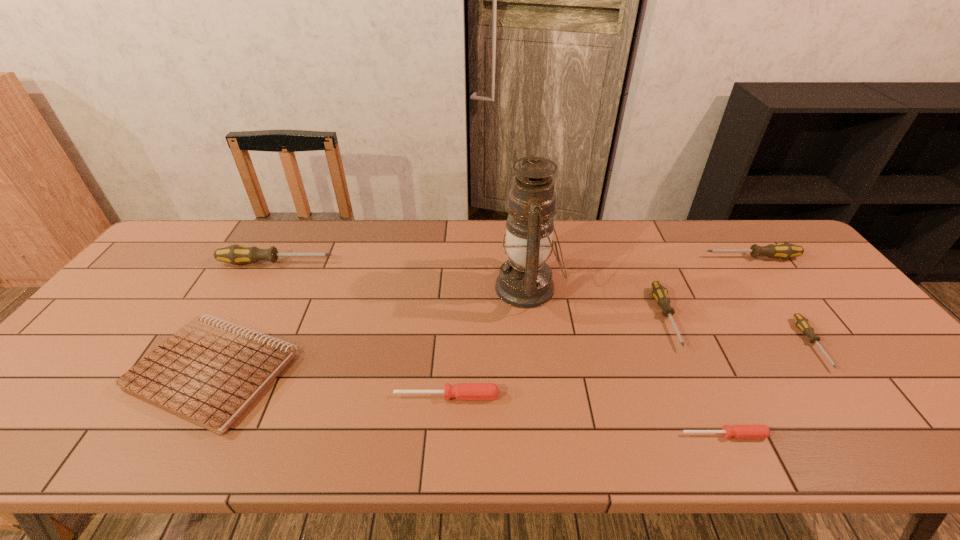
You are a GUI agent. You are given a task and a screenshot of the screen. Output one action in this format:
    pyautogui.click(x=<x>, y=<y>)
    Task: Click on the vacant region located on the back of the notebook
    
    Given the screenshot: What is the action you would take?
    pyautogui.click(x=274, y=262)

Image resolution: width=960 pixels, height=540 pixels. In order to click on vacant region located 0.140m on the back of the second nearest screwdriver in this screenshot , I will do `click(450, 343)`.

Image resolution: width=960 pixels, height=540 pixels. What are the coordinates of `vacant space situated at the tip of the smallest gray screwdriver` in the screenshot? It's located at (854, 402).

At what (x,y) coordinates should I click in order to perform the action: click on vacant area located 0.210m on the back of the shortest screwdriver. Please return your answer as a coordinate pair (x, y). The width and height of the screenshot is (960, 540). Looking at the image, I should click on (687, 353).

This screenshot has height=540, width=960. Identify the location of oil lamp located at the far edge. (525, 281).

Identify the location of notebook present at the near edge. This screenshot has height=540, width=960. (209, 373).

The height and width of the screenshot is (540, 960). What are the coordinates of `screwdriver at the near edge` in the screenshot? It's located at (739, 431).

I want to click on object located at the far right corner, so (784, 250).

In the image, there is a desktop. Where is `free space at the far edge`? The height and width of the screenshot is (540, 960). free space at the far edge is located at coordinates (312, 221).

Locate an element on the screen. vacant space at the near edge of the desktop is located at coordinates click(478, 447).